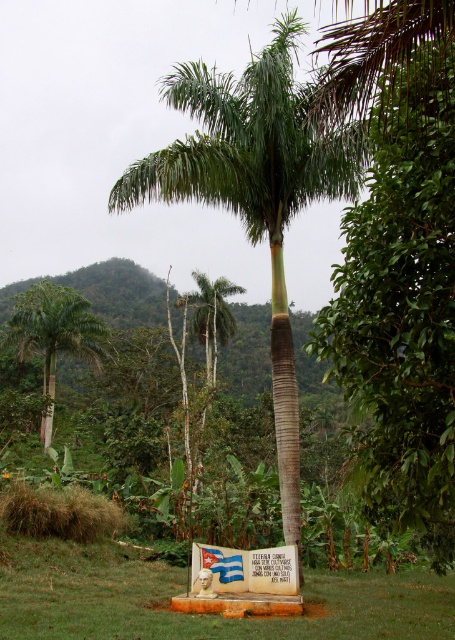
Question: Can you confirm if green leafy palm tree at center is bigger than green grass at center?

Choices:
 (A) no
 (B) yes

Answer: (B)

Question: Does green leafy palm tree at center appear on the right side of green grass at center?

Choices:
 (A) no
 (B) yes

Answer: (A)

Question: Considering the real-world distances, which object is farthest from the green grass at center?

Choices:
 (A) green leafy tree at center
 (B) green leafy palm tree at center
 (C) green leafy palm tree at left

Answer: (C)

Question: Can you confirm if green leafy palm tree at center is smaller than green grass at center?

Choices:
 (A) yes
 (B) no

Answer: (B)

Question: Which point is closer to the camera?

Choices:
 (A) green leafy tree at center
 (B) green leafy palm tree at center
 (C) green leafy palm tree at left
 (D) green grass at center

Answer: (A)

Question: Considering the real-world distances, which object is farthest from the green leafy palm tree at left?

Choices:
 (A) green grass at center
 (B) green leafy tree at center
 (C) green leafy palm tree at center

Answer: (A)